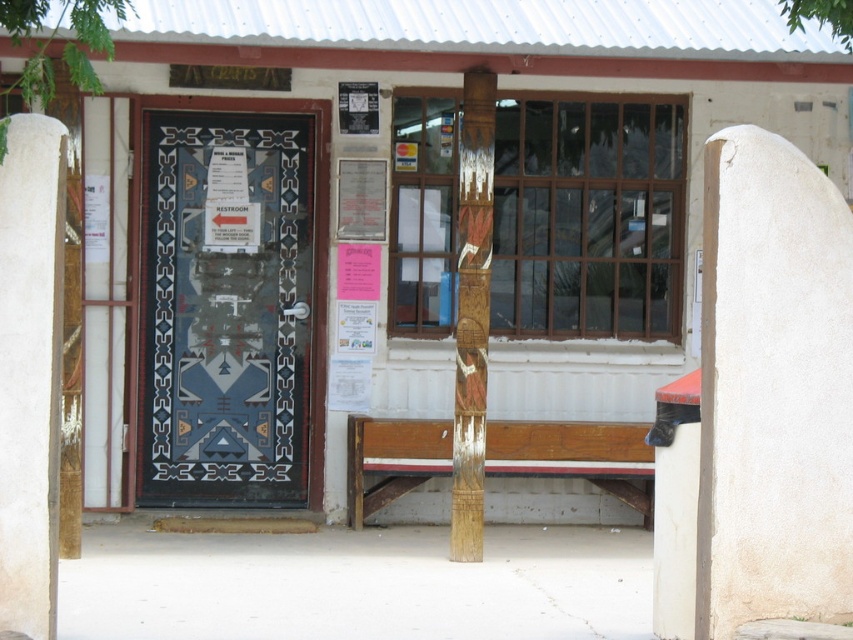
Between decorative glass door at center and wooden bench at center, which one has more height?

decorative glass door at center is taller.

Can you confirm if decorative glass door at center is wider than wooden bench at center?

Indeed, decorative glass door at center has a greater width compared to wooden bench at center.

The width and height of the screenshot is (853, 640). What do you see at coordinates (225, 308) in the screenshot? I see `decorative glass door at center` at bounding box center [225, 308].

The height and width of the screenshot is (640, 853). I want to click on decorative glass door at center, so click(x=225, y=308).

Can you confirm if white stucco pillar at center is wider than wooden totem pole at center?

No.

Does white stucco pillar at center appear over wooden totem pole at center?

No.

What do you see at coordinates (30, 371) in the screenshot?
I see `white stucco pillar at center` at bounding box center [30, 371].

This screenshot has height=640, width=853. I want to click on white stucco pillar at center, so click(30, 371).

Is decorative glass door at center positioned behind wooden totem pole at center?

Yes, it is behind wooden totem pole at center.

I want to click on decorative glass door at center, so click(225, 308).

Describe the element at coordinates (225, 308) in the screenshot. I see `decorative glass door at center` at that location.

Locate an element on the screen. Image resolution: width=853 pixels, height=640 pixels. decorative glass door at center is located at coordinates (225, 308).